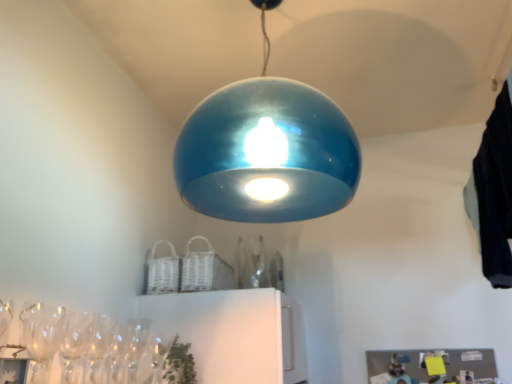
Question: From a real-world perspective, relative to clear glass wine glass at lower left, is dark blue fabric at upper right vertically above or below?

Choices:
 (A) above
 (B) below

Answer: (A)

Question: Considering the positions of dark blue fabric at upper right and clear glass wine glass at lower left in the image, is dark blue fabric at upper right wider or thinner than clear glass wine glass at lower left?

Choices:
 (A) wide
 (B) thin

Answer: (A)

Question: Which object is the farthest from the glossy blue dome at center?

Choices:
 (A) dark blue fabric at upper right
 (B) clear glass wine glass at lower left

Answer: (B)

Question: Estimate the real-world distances between objects in this image. Which object is farther from the glossy blue dome at center?

Choices:
 (A) clear glass wine glass at lower left
 (B) dark blue fabric at upper right

Answer: (A)